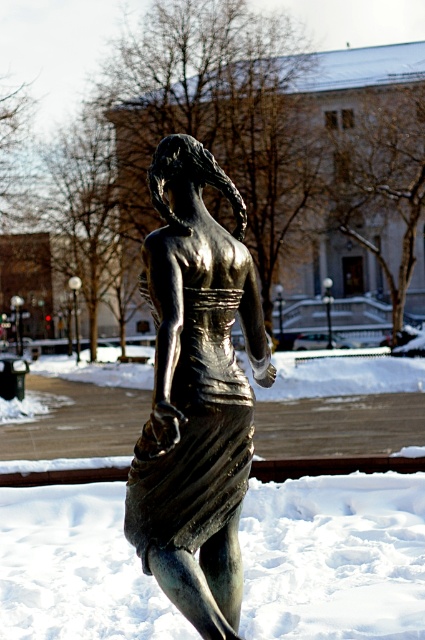
Question: Which of these objects is positioned farthest from the shiny bronze dress at center?

Choices:
 (A) shiny bronze statue at center
 (B) white frosty snow at lower center

Answer: (B)

Question: Does white frosty snow at lower center have a lesser width compared to shiny bronze statue at center?

Choices:
 (A) yes
 (B) no

Answer: (B)

Question: Is white frosty snow at lower center positioned in front of shiny bronze statue at center?

Choices:
 (A) yes
 (B) no

Answer: (B)

Question: In this image, where is white frosty snow at lower center located relative to shiny bronze dress at center?

Choices:
 (A) below
 (B) above

Answer: (A)

Question: Among these objects, which one is farthest from the camera?

Choices:
 (A) shiny bronze statue at center
 (B) shiny bronze dress at center

Answer: (B)

Question: Which point is closer to the camera taking this photo?

Choices:
 (A) (195, 438)
 (B) (362, 516)

Answer: (A)